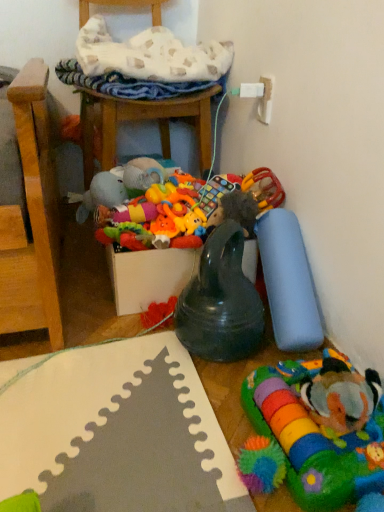
Where is `wooden chair at upper center`? wooden chair at upper center is located at coordinates (144, 82).

This screenshot has height=512, width=384. Find the location of `soft plush toy at center, acting as the 1th toy starting from the left`. soft plush toy at center, acting as the 1th toy starting from the left is located at coordinates (120, 185).

Locate an element on the screen. rubberized plastic rattle at right, placed as the third toy when sorted from left to right is located at coordinates (264, 188).

Would you say soft plush toy at center, placed as the fifth toy when sorted from right to left, is to the left or to the right of rubberized plastic rattle at right, placed as the third toy when sorted from left to right, in the picture?

From the image, it's evident that soft plush toy at center, placed as the fifth toy when sorted from right to left, is to the left of rubberized plastic rattle at right, placed as the third toy when sorted from left to right.

From a real-world perspective, relative to rubberized plastic rattle at right, placed as the third toy when sorted from left to right, is soft plush toy at center, placed as the fifth toy when sorted from right to left, vertically above or below?

In terms of real-world spatial position, soft plush toy at center, placed as the fifth toy when sorted from right to left, is below rubberized plastic rattle at right, placed as the third toy when sorted from left to right.

Is soft plush toy at center, placed as the fifth toy when sorted from right to left, positioned with its back to rubberized plastic rattle at right, which ranks as the 3th toy in right-to-left order?

No, soft plush toy at center, placed as the fifth toy when sorted from right to left, is not facing the opposite direction of rubberized plastic rattle at right, which ranks as the 3th toy in right-to-left order.

Is rubberized black teething ring at center, which appears as the 4th toy when viewed from the right, taller or shorter than multicolored plush toy at lower right, which appears as the second toy when viewed from the right?

Clearly, rubberized black teething ring at center, which appears as the 4th toy when viewed from the right, is taller compared to multicolored plush toy at lower right, which appears as the second toy when viewed from the right.

Considering the sizes of objects rubberized black teething ring at center, which appears as the 4th toy when viewed from the right, and multicolored plush toy at lower right, which appears as the second toy when viewed from the right, in the image provided, who is bigger, rubberized black teething ring at center, which appears as the 4th toy when viewed from the right, or multicolored plush toy at lower right, which appears as the second toy when viewed from the right,?

rubberized black teething ring at center, which appears as the 4th toy when viewed from the right.

Can you confirm if rubberized black teething ring at center, the second toy from the left, is positioned to the right of multicolored plush toy at lower right, which appears as the second toy when viewed from the right?

In fact, rubberized black teething ring at center, the second toy from the left, is to the left of multicolored plush toy at lower right, which appears as the second toy when viewed from the right.

From the image's perspective, is rubberized black teething ring at center, which appears as the 4th toy when viewed from the right, above soft plush clownfish at lower right, marked as the fifth toy in a left-to-right arrangement?

Yes, from the image's perspective, rubberized black teething ring at center, which appears as the 4th toy when viewed from the right, is above soft plush clownfish at lower right, marked as the fifth toy in a left-to-right arrangement.

Is rubberized black teething ring at center, the second toy from the left, shorter than soft plush clownfish at lower right, marked as the fifth toy in a left-to-right arrangement?

Incorrect, the height of rubberized black teething ring at center, the second toy from the left, does not fall short of that of soft plush clownfish at lower right, marked as the fifth toy in a left-to-right arrangement.

Which of these two, rubberized black teething ring at center, which appears as the 4th toy when viewed from the right, or soft plush clownfish at lower right, marked as the fifth toy in a left-to-right arrangement, is smaller?

With smaller size is soft plush clownfish at lower right, marked as the fifth toy in a left-to-right arrangement.

Looking at this image, in terms of width, does soft plush toy at center, placed as the fifth toy when sorted from right to left, look wider or thinner when compared to soft plush clownfish at lower right, marked as the fifth toy in a left-to-right arrangement?

soft plush toy at center, placed as the fifth toy when sorted from right to left, is wider than soft plush clownfish at lower right, marked as the fifth toy in a left-to-right arrangement.

How many degrees apart are the facing directions of soft plush toy at center, placed as the fifth toy when sorted from right to left, and soft plush clownfish at lower right, marked as the 1th toy in a right-to-left arrangement?

soft plush toy at center, placed as the fifth toy when sorted from right to left, and soft plush clownfish at lower right, marked as the 1th toy in a right-to-left arrangement, are facing 85.7 degrees away from each other.

From the soft plush toy at center, placed as the fifth toy when sorted from right to left, count 4th toy to the right and point to it. Please provide its 2D coordinates.

[(335, 391)]

Considering the sizes of objects soft plush toy at center, placed as the fifth toy when sorted from right to left, and soft plush clownfish at lower right, marked as the 1th toy in a right-to-left arrangement, in the image provided, who is shorter, soft plush toy at center, placed as the fifth toy when sorted from right to left, or soft plush clownfish at lower right, marked as the 1th toy in a right-to-left arrangement,?

With less height is soft plush clownfish at lower right, marked as the 1th toy in a right-to-left arrangement.

How many degrees apart are the facing directions of rubberized black teething ring at center, which appears as the 4th toy when viewed from the right, and wooden chair at upper center?

They differ by 101 degrees in their facing directions.

Between point (244, 293) and point (177, 103), which one is positioned in front?

The point (244, 293) is more forward.

From the image's perspective, is rubberized black teething ring at center, which appears as the 4th toy when viewed from the right, located above or below wooden chair at upper center?

rubberized black teething ring at center, which appears as the 4th toy when viewed from the right, is situated lower than wooden chair at upper center in the image.

In the scene shown: Does rubberized black teething ring at center, the second toy from the left, have a greater height compared to wooden chair at upper center?

In fact, rubberized black teething ring at center, the second toy from the left, may be shorter than wooden chair at upper center.

From the image's perspective, is multicolored plush toy at lower right, which appears as the second toy when viewed from the right, positioned above or below rubberized plastic rattle at right, placed as the third toy when sorted from left to right?

multicolored plush toy at lower right, which appears as the second toy when viewed from the right, is below rubberized plastic rattle at right, placed as the third toy when sorted from left to right.

Is multicolored plush toy at lower right, which appears as the second toy when viewed from the right, located outside rubberized plastic rattle at right, placed as the third toy when sorted from left to right?

Yes, multicolored plush toy at lower right, which appears as the second toy when viewed from the right, is not within rubberized plastic rattle at right, placed as the third toy when sorted from left to right.

Which of these two, multicolored plush toy at lower right, marked as the 4th toy in a left-to-right arrangement, or rubberized plastic rattle at right, placed as the third toy when sorted from left to right, stands taller?

rubberized plastic rattle at right, placed as the third toy when sorted from left to right.

How many degrees apart are the facing directions of multicolored plush toy at lower right, marked as the 4th toy in a left-to-right arrangement, and rubberized plastic rattle at right, which ranks as the 3th toy in right-to-left order?

89.9 degrees separate the facing orientations of multicolored plush toy at lower right, marked as the 4th toy in a left-to-right arrangement, and rubberized plastic rattle at right, which ranks as the 3th toy in right-to-left order.

Considering the points (274, 197) and (356, 381), which point is in front, point (274, 197) or point (356, 381)?

Point (356, 381)

Is rubberized plastic rattle at right, which ranks as the 3th toy in right-to-left order, at the right side of soft plush clownfish at lower right, marked as the fifth toy in a left-to-right arrangement?

In fact, rubberized plastic rattle at right, which ranks as the 3th toy in right-to-left order, is to the left of soft plush clownfish at lower right, marked as the fifth toy in a left-to-right arrangement.

Would you say soft plush clownfish at lower right, marked as the fifth toy in a left-to-right arrangement, is part of rubberized plastic rattle at right, placed as the third toy when sorted from left to right,'s contents?

No, soft plush clownfish at lower right, marked as the fifth toy in a left-to-right arrangement, is located outside of rubberized plastic rattle at right, placed as the third toy when sorted from left to right.

Is rubberized plastic rattle at right, placed as the third toy when sorted from left to right, facing towards soft plush clownfish at lower right, marked as the 1th toy in a right-to-left arrangement?

Yes, rubberized plastic rattle at right, placed as the third toy when sorted from left to right, is facing soft plush clownfish at lower right, marked as the 1th toy in a right-to-left arrangement.

This screenshot has width=384, height=512. In order to click on toy that is the 2nd one when counting rightward from the soft plush toy at center, placed as the fifth toy when sorted from right to left in this screenshot , I will do `click(264, 188)`.

From a real-world perspective, count 2nd toys downward from the rubberized black teething ring at center, which appears as the 4th toy when viewed from the right, and point to it. Please provide its 2D coordinates.

[(321, 428)]

Which object lies nearer to the anchor point rubberized plastic rattle at right, placed as the third toy when sorted from left to right, wooden chair at upper center or soft plush toy at center, acting as the 1th toy starting from the left?

Based on the image, soft plush toy at center, acting as the 1th toy starting from the left, appears to be nearer to rubberized plastic rattle at right, placed as the third toy when sorted from left to right.

Looking at the image, which one is located further to rubberized black teething ring at center, which appears as the 4th toy when viewed from the right, wooden chair at upper center or multicolored plush toy at lower right, which appears as the second toy when viewed from the right?

The object further to rubberized black teething ring at center, which appears as the 4th toy when viewed from the right, is wooden chair at upper center.

When comparing their distances from soft plush clownfish at lower right, marked as the fifth toy in a left-to-right arrangement, does wooden chair at upper center or soft plush toy at center, placed as the fifth toy when sorted from right to left, seem closer?

Based on the image, soft plush toy at center, placed as the fifth toy when sorted from right to left, appears to be nearer to soft plush clownfish at lower right, marked as the fifth toy in a left-to-right arrangement.

From the image, which object appears to be nearer to soft plush toy at center, acting as the 1th toy starting from the left, rubberized black teething ring at center, which appears as the 4th toy when viewed from the right, or multicolored plush toy at lower right, marked as the 4th toy in a left-to-right arrangement?

Based on the image, rubberized black teething ring at center, which appears as the 4th toy when viewed from the right, appears to be nearer to soft plush toy at center, acting as the 1th toy starting from the left.

When comparing their distances from multicolored plush toy at lower right, marked as the 4th toy in a left-to-right arrangement, does rubberized black teething ring at center, which appears as the 4th toy when viewed from the right, or soft plush clownfish at lower right, marked as the 1th toy in a right-to-left arrangement, seem further?

The object further to multicolored plush toy at lower right, marked as the 4th toy in a left-to-right arrangement, is rubberized black teething ring at center, which appears as the 4th toy when viewed from the right.

When comparing their distances from soft plush clownfish at lower right, marked as the fifth toy in a left-to-right arrangement, does rubberized black teething ring at center, which appears as the 4th toy when viewed from the right, or wooden chair at upper center seem further?

The object further to soft plush clownfish at lower right, marked as the fifth toy in a left-to-right arrangement, is wooden chair at upper center.

Estimate the real-world distances between objects in this image. Which object is further from rubberized black teething ring at center, the second toy from the left, multicolored plush toy at lower right, which appears as the second toy when viewed from the right, or wooden chair at upper center?

Based on the image, wooden chair at upper center appears to be further to rubberized black teething ring at center, the second toy from the left.

From the image, which object appears to be farther from soft plush clownfish at lower right, marked as the 1th toy in a right-to-left arrangement, multicolored plush toy at lower right, marked as the 4th toy in a left-to-right arrangement, or rubberized black teething ring at center, the second toy from the left?

rubberized black teething ring at center, the second toy from the left, is positioned further to the anchor soft plush clownfish at lower right, marked as the 1th toy in a right-to-left arrangement.

What are the coordinates of `chair between soft plush toy at center, acting as the 1th toy starting from the left, and rubberized plastic rattle at right, placed as the third toy when sorted from left to right, in the horizontal direction` in the screenshot? It's located at point(144,82).

In order to click on toy between soft plush toy at center, placed as the fifth toy when sorted from right to left, and rubberized plastic rattle at right, which ranks as the 3th toy in right-to-left order, from left to right in this screenshot , I will do `click(220, 302)`.

Identify the location of toy between rubberized plastic rattle at right, which ranks as the 3th toy in right-to-left order, and soft plush clownfish at lower right, marked as the 1th toy in a right-to-left arrangement, vertically. The image size is (384, 512). tap(220, 302).

In order to click on toy between rubberized black teething ring at center, which appears as the 4th toy when viewed from the right, and multicolored plush toy at lower right, marked as the 4th toy in a left-to-right arrangement, from top to bottom in this screenshot , I will do `click(335, 391)`.